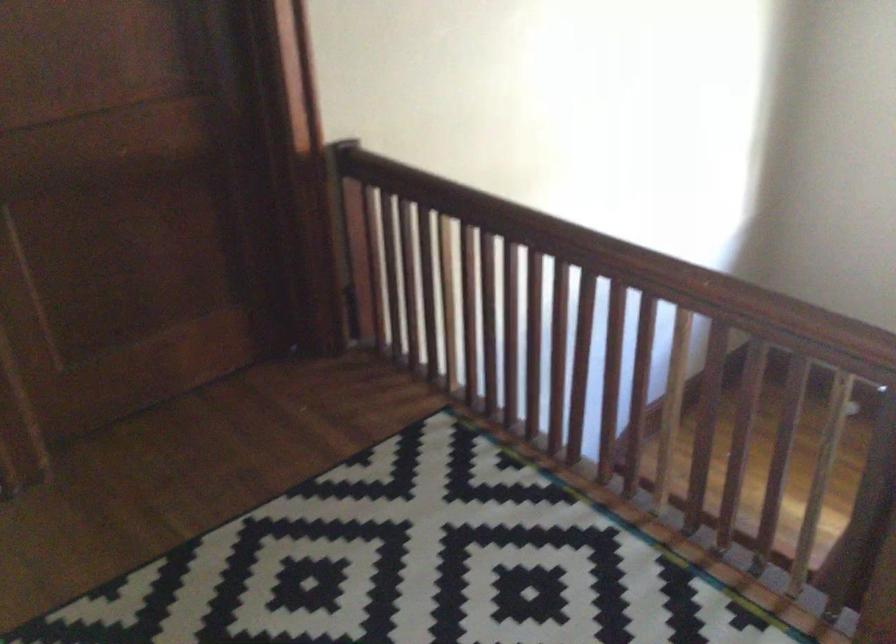
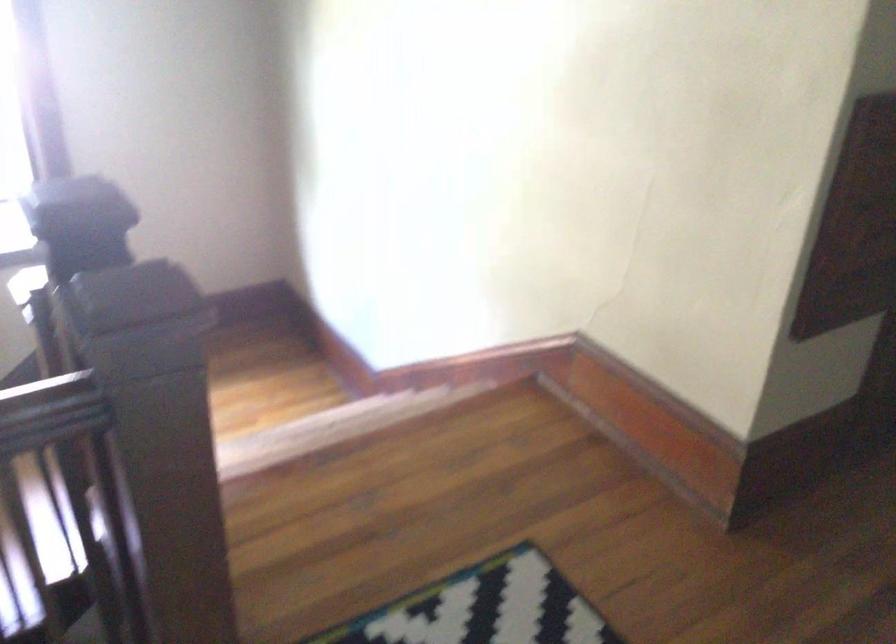
How did the camera likely rotate?

The camera rotated toward right-down.